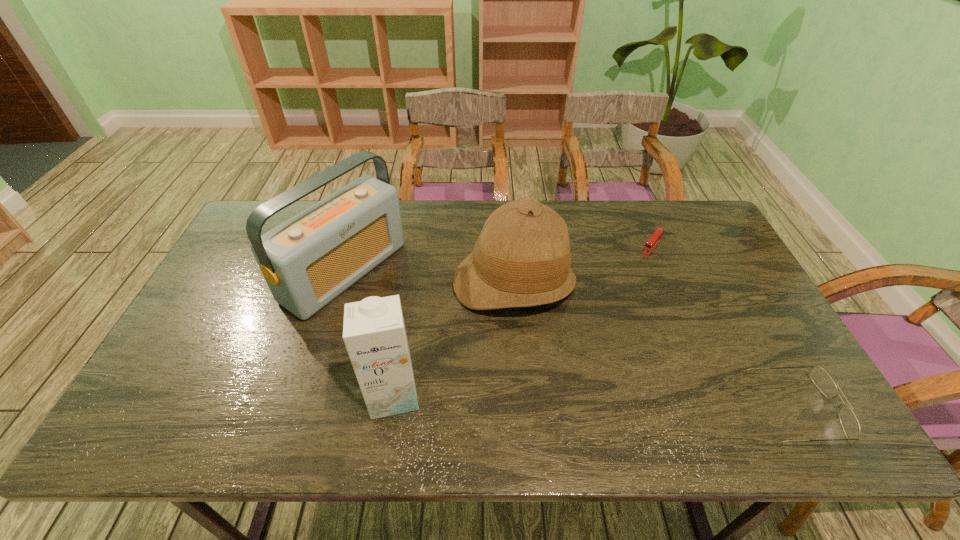
This screenshot has height=540, width=960. In order to click on carton in this screenshot , I will do `click(374, 333)`.

Image resolution: width=960 pixels, height=540 pixels. I want to click on spectacles, so pos(850,424).

The width and height of the screenshot is (960, 540). I want to click on the rightmost object, so click(x=850, y=424).

Locate an element on the screen. stapler is located at coordinates (658, 234).

I want to click on the shortest object, so click(658, 234).

You are a GUI agent. You are given a task and a screenshot of the screen. Output one action in this format:
    pyautogui.click(x=<x>, y=<y>)
    Task: Click on the third object from right to left
    The image size is (960, 540).
    Given the screenshot: What is the action you would take?
    pyautogui.click(x=522, y=258)

The height and width of the screenshot is (540, 960). I want to click on radio receiver, so pos(307,261).

The width and height of the screenshot is (960, 540). What are the coordinates of `vacant space situated 0.200m on the left of the carton` in the screenshot? It's located at (281, 394).

I want to click on free spot located 0.310m on the front-facing side of the stapler, so click(603, 312).

Find the location of a particular element. free spot located on the front-facing side of the stapler is located at coordinates (594, 323).